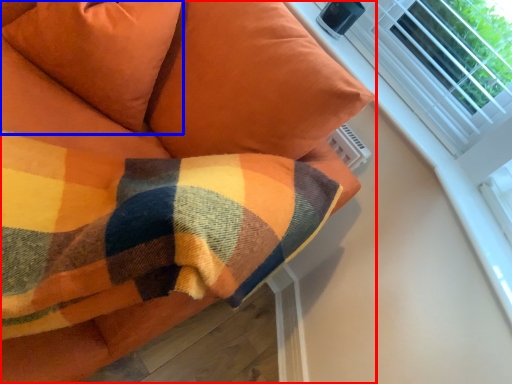
Question: Which of the following is the farthest to the observer, furniture (highlighted by a red box) or pillow (highlighted by a blue box)?

Choices:
 (A) furniture
 (B) pillow

Answer: (B)